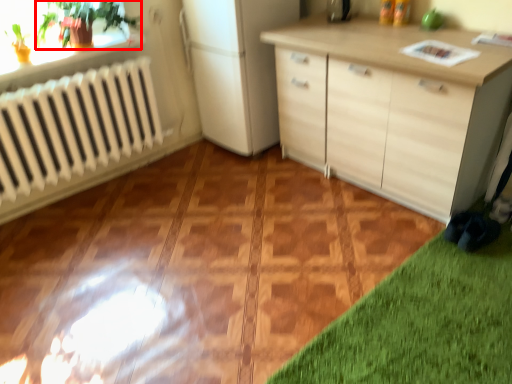
Question: From the image's perspective, what is the correct spatial relationship of plant (annotated by the red box) in relation to appliance?

Choices:
 (A) above
 (B) below

Answer: (B)